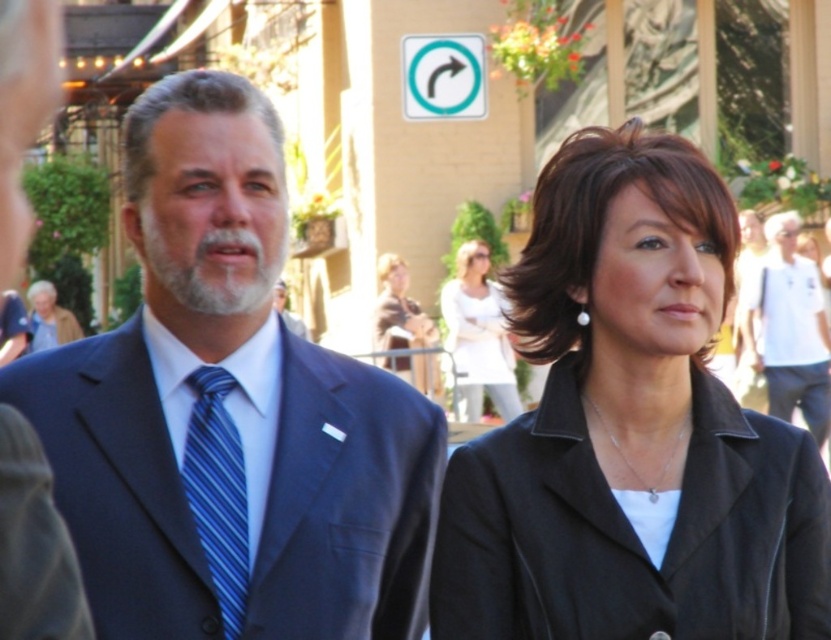
You are a photographer adjusting your camera settings to focus on the black matte jacket at upper right and the teal plastic arrow at upper center. Which object should you set a closer focus distance for, considering their sizes?

The black matte jacket at upper right is bigger than the teal plastic arrow at upper center, so you should set a closer focus distance for the teal plastic arrow at upper center to ensure it is in focus.

You are a photographer at the event and want to capture a photo where both the blue striped tie at center and the teal plastic arrow at upper center are visible. Which object should you position closer to the left side of the frame to ensure both are in the shot?

The teal plastic arrow at upper center should be positioned closer to the left side of the frame since the blue striped tie at center is on the right side of it, allowing both to fit within the shot.